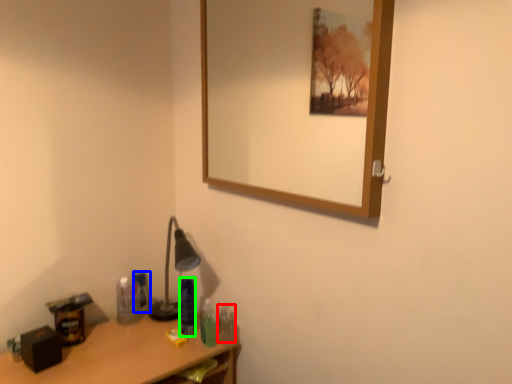
Question: Which object is the closest to the toiletry (highlighted by a red box)? Choose among these: toiletry (highlighted by a blue box) or toiletry (highlighted by a green box).

Choices:
 (A) toiletry
 (B) toiletry

Answer: (B)